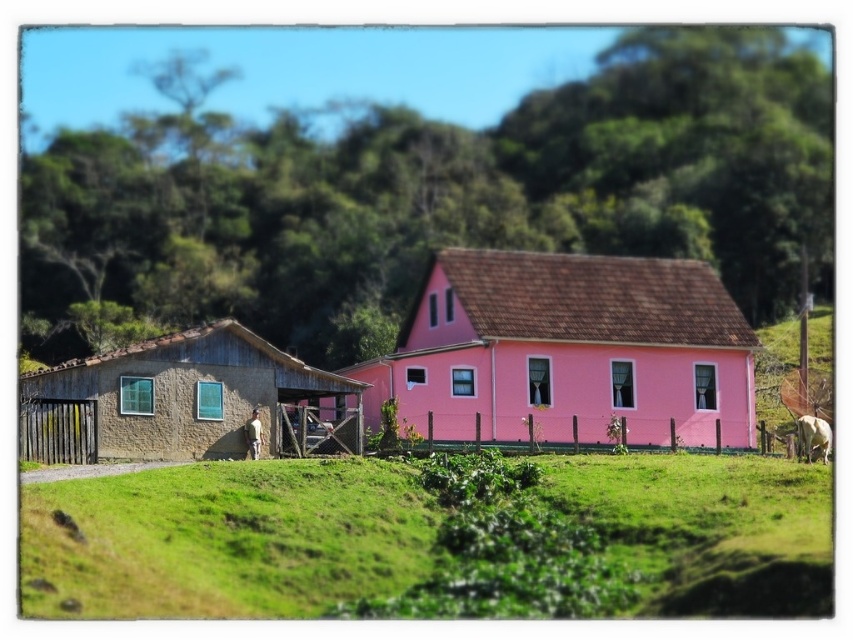
Question: Considering the real-world distances, which object is closest to the stucco hut at left?

Choices:
 (A) pink matte house at center
 (B) green grassy field at lower center

Answer: (B)

Question: Which point appears farthest from the camera in this image?

Choices:
 (A) (190, 573)
 (B) (83, 426)

Answer: (B)

Question: Where is green grassy field at lower center located in relation to pink matte house at center in the image?

Choices:
 (A) left
 (B) right

Answer: (A)

Question: Where is green grassy field at lower center located in relation to pink matte house at center in the image?

Choices:
 (A) above
 (B) below

Answer: (B)

Question: Which point is farther to the camera?

Choices:
 (A) (677, 282)
 (B) (323, 460)
 (C) (103, 412)

Answer: (A)

Question: Does pink matte house at center appear over stucco hut at left?

Choices:
 (A) yes
 (B) no

Answer: (A)